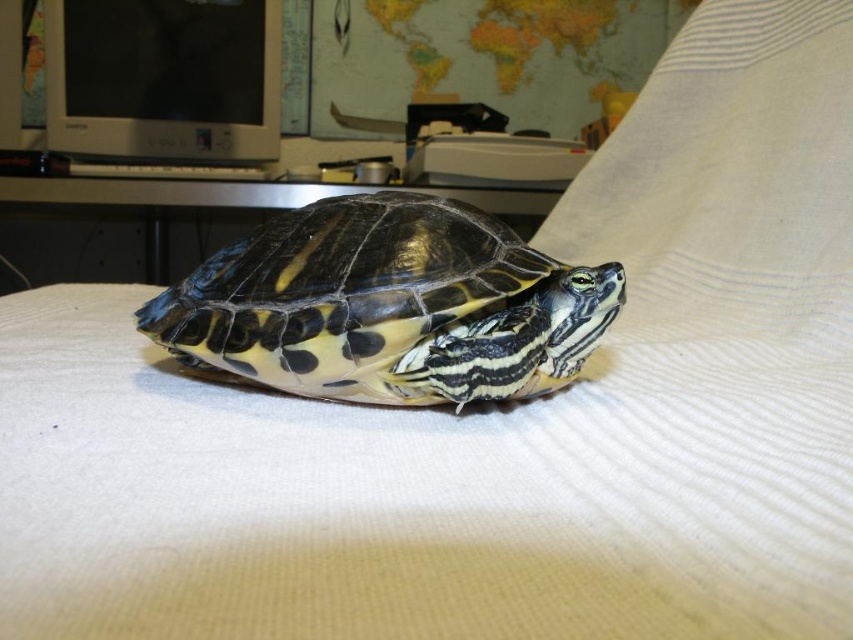
You are a child who wants to pet the shiny black tortoise at center. You are currently standing 28.96 inches away from it. Can you reach it?

The distance between you and the shiny black tortoise at center is 28.96 inches. Since the average child can reach up to 24 inches, you cannot reach it.

You are setting up a new pet enclosure for the shiny black tortoise at center and the metallic silver table at center. Which object requires a narrower space to accommodate its width?

The shiny black tortoise at center requires a narrower space because it is thinner than the metallic silver table at center.